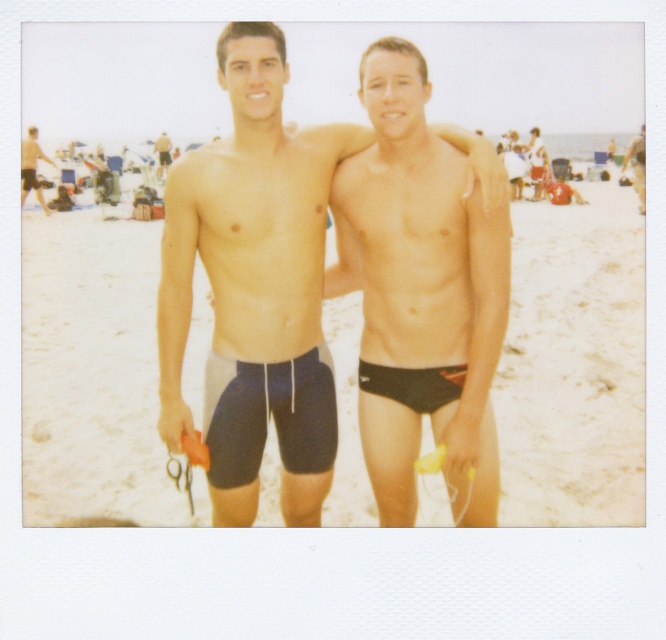
Question: Which object appears closest to the camera in this image?

Choices:
 (A) dark blue fabric shorts at center
 (B) matte black shorts at upper right

Answer: (A)

Question: Which of the following is the farthest from the observer?

Choices:
 (A) matte black shorts at center
 (B) beige sand at center
 (C) matte black shorts at left
 (D) black matte shorts at center

Answer: (A)

Question: Considering the relative positions of beige sand at center and matte black shorts at upper right in the image provided, where is beige sand at center located with respect to matte black shorts at upper right?

Choices:
 (A) below
 (B) above

Answer: (A)

Question: Does beige sand at center lie in front of black matte shorts at center?

Choices:
 (A) no
 (B) yes

Answer: (B)

Question: Is matte black shorts at upper right positioned behind black matte shorts at center?

Choices:
 (A) yes
 (B) no

Answer: (A)

Question: Which object is the farthest from the black matte shorts at center?

Choices:
 (A) beige sand at center
 (B) matte black shorts at upper right
 (C) matte black shorts at left
 (D) dark blue fabric shorts at center

Answer: (D)